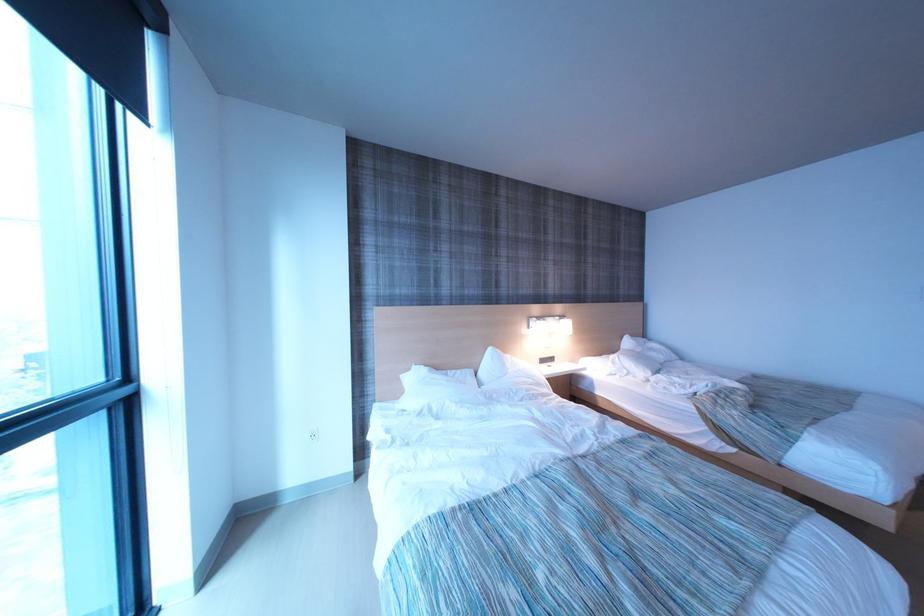
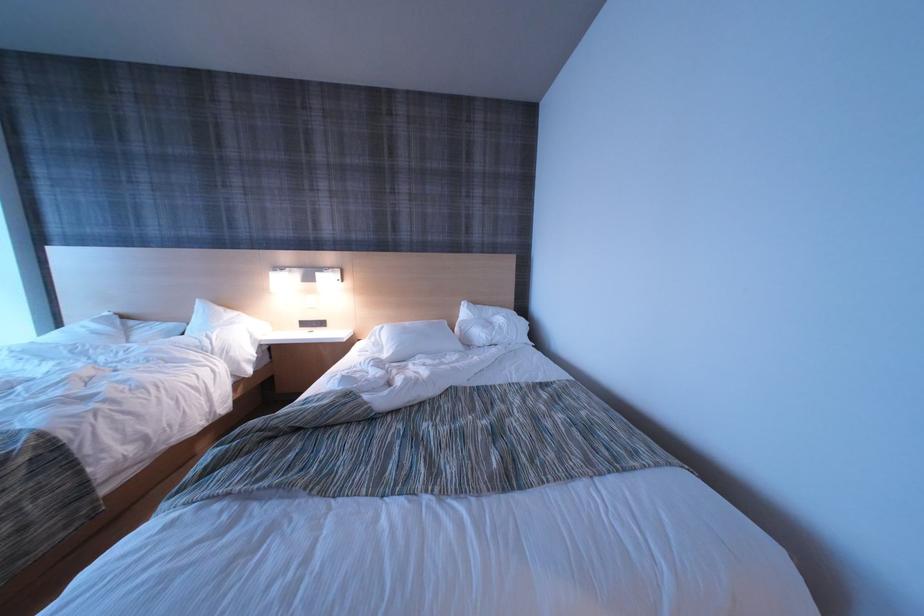
Which direction would the cameraman need to move to produce the second image?

The movement direction of the cameraman is right, forward.